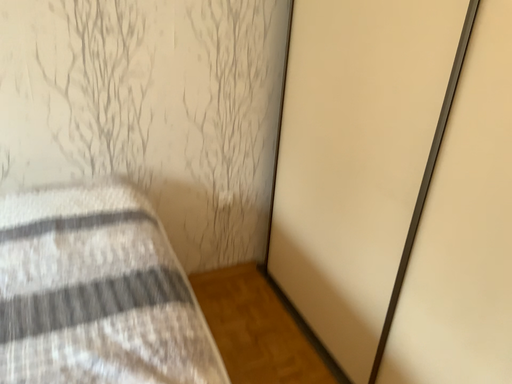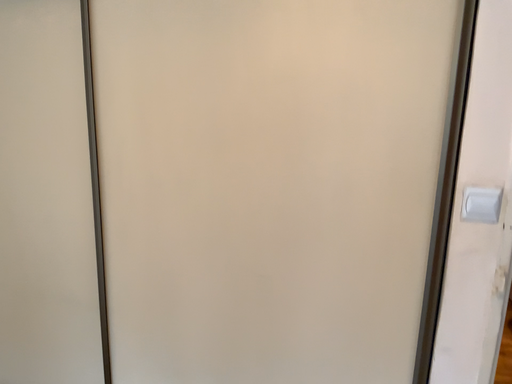
Question: Which way did the camera rotate in the video?

Choices:
 (A) rotated downward
 (B) rotated upward

Answer: (B)